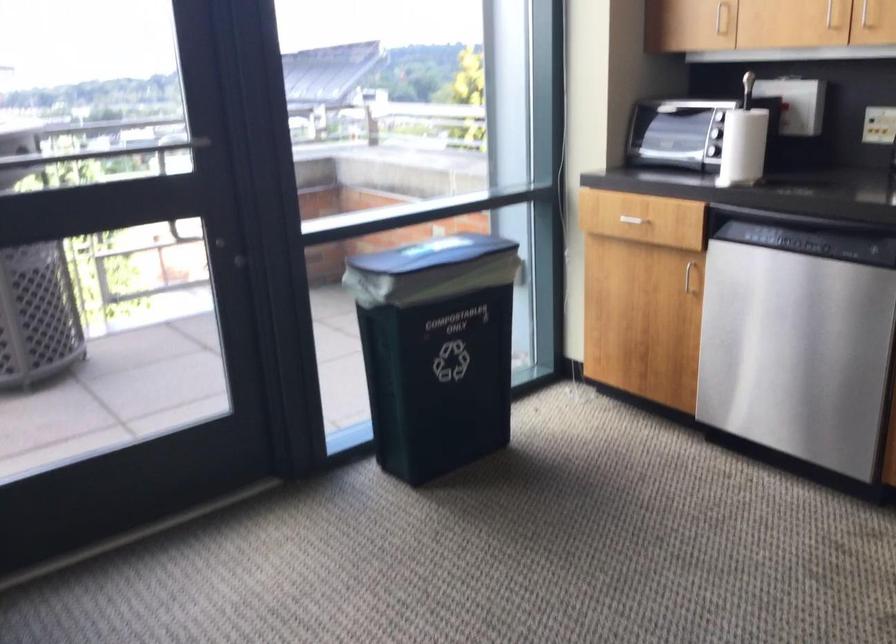
Where would you turn the toaster oven knob? Please return your answer as a coordinate pair (x, y).

(712, 146)